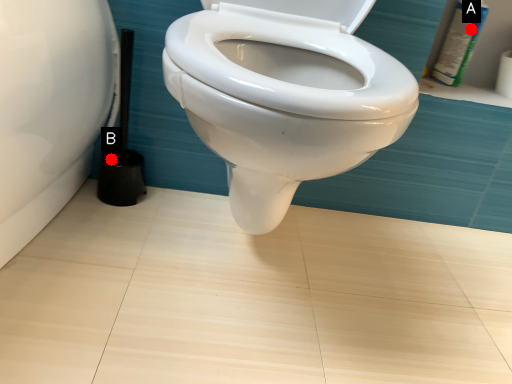
Question: Two points are circled on the image, labeled by A and B beside each circle. Which point is closer to the camera taking this photo?

Choices:
 (A) A is closer
 (B) B is closer

Answer: (B)